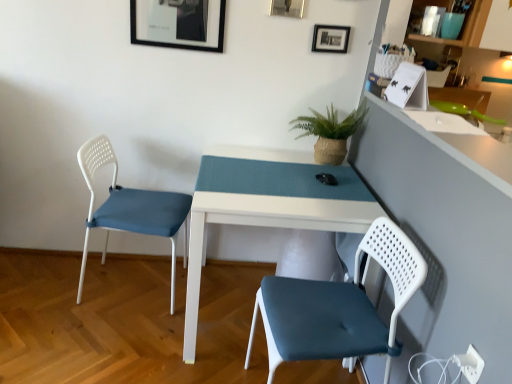
Where is `free spot below white plastic chair at left, arranged as the first chair when viewed from the back (from a real-world perspective)`? This screenshot has height=384, width=512. free spot below white plastic chair at left, arranged as the first chair when viewed from the back (from a real-world perspective) is located at coordinates (129, 291).